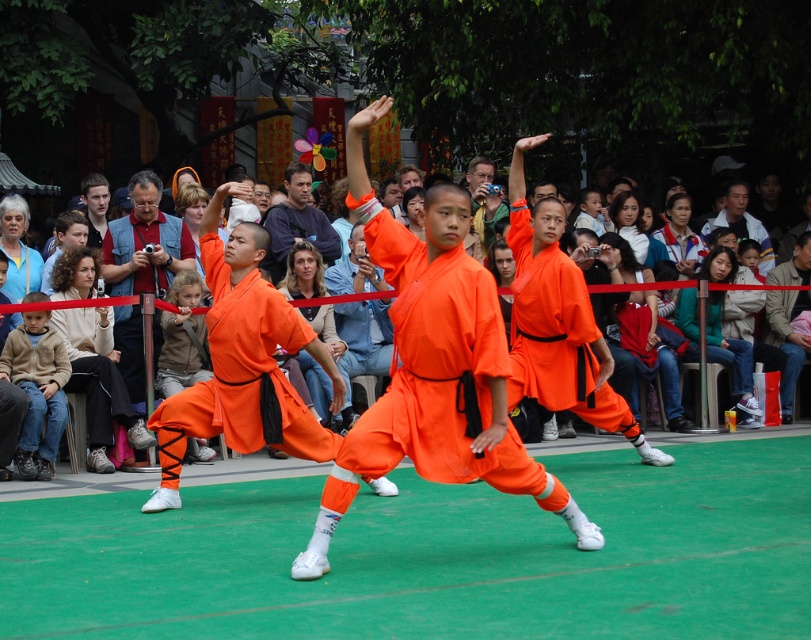
Question: Which object is the closest to the denim jacket at lower right?

Choices:
 (A) matte orange robe at center
 (B) orange cotton pants at center
 (C) light brown leather jacket at center
 (D) orange cotton robe at center

Answer: (A)

Question: Which point is farther from the camera taking this photo?

Choices:
 (A) (744, 372)
 (B) (784, 321)

Answer: (B)

Question: Can you confirm if light brown leather jacket at center is positioned to the right of brown fleece jacket at lower left?

Choices:
 (A) no
 (B) yes

Answer: (B)

Question: Does gray hair woman at center have a smaller size compared to matte orange robe at center?

Choices:
 (A) no
 (B) yes

Answer: (B)

Question: Is light brown leather jacket at center positioned before brown fleece jacket at lower left?

Choices:
 (A) yes
 (B) no

Answer: (B)

Question: Which point is closer to the camera?

Choices:
 (A) orange cotton pants at center
 (B) denim jacket at lower right
 (C) light brown leather jacket at center

Answer: (C)